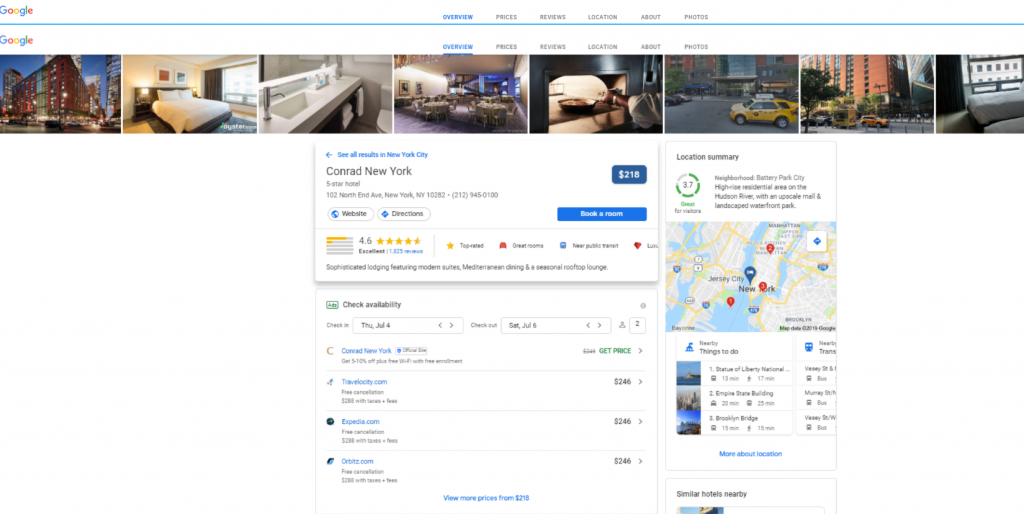
At what (x,y) coordinates should I click in order to perform the action: click on big window. Please return your answer as a coordinate pair (x, y). Image resolution: width=1024 pixels, height=514 pixels. Looking at the image, I should click on (237, 84).